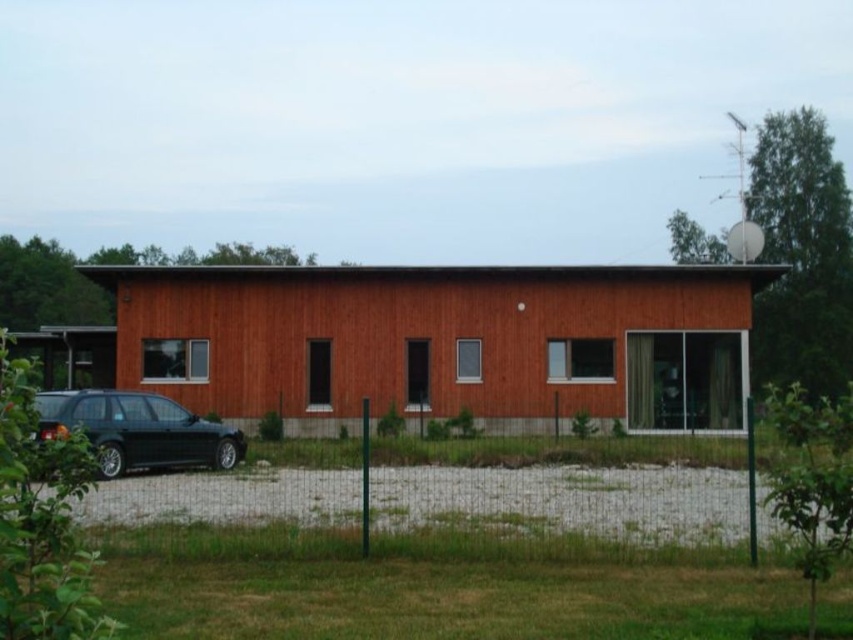
Question: Is the position of wooden barn at center more distant than that of shiny dark gray car at lower left?

Choices:
 (A) no
 (B) yes

Answer: (B)

Question: Can you confirm if wooden barn at center is positioned to the left of shiny dark gray car at lower left?

Choices:
 (A) no
 (B) yes

Answer: (A)

Question: Which point appears closest to the camera in this image?

Choices:
 (A) (86, 417)
 (B) (181, 300)

Answer: (A)

Question: Does wooden barn at center have a greater width compared to shiny dark gray car at lower left?

Choices:
 (A) yes
 (B) no

Answer: (A)